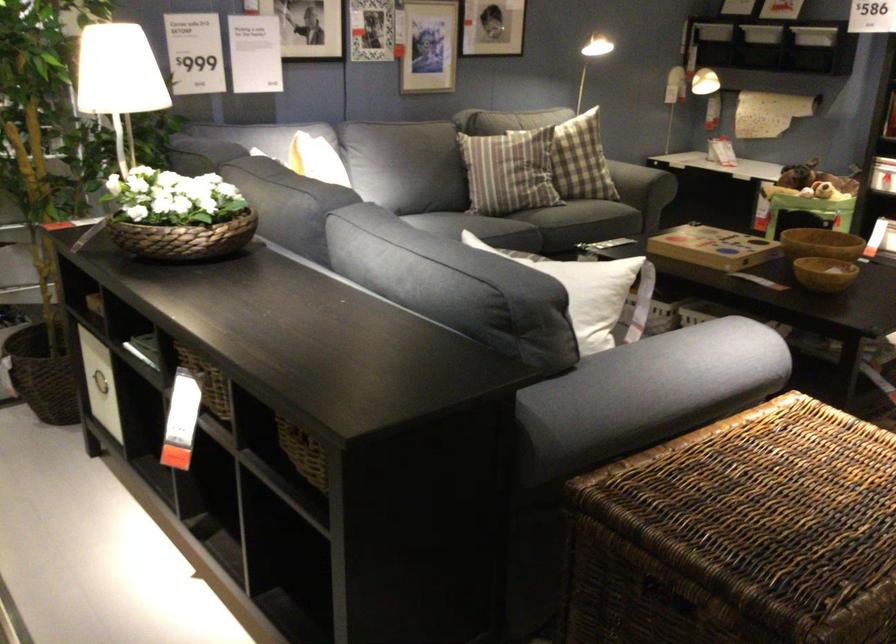
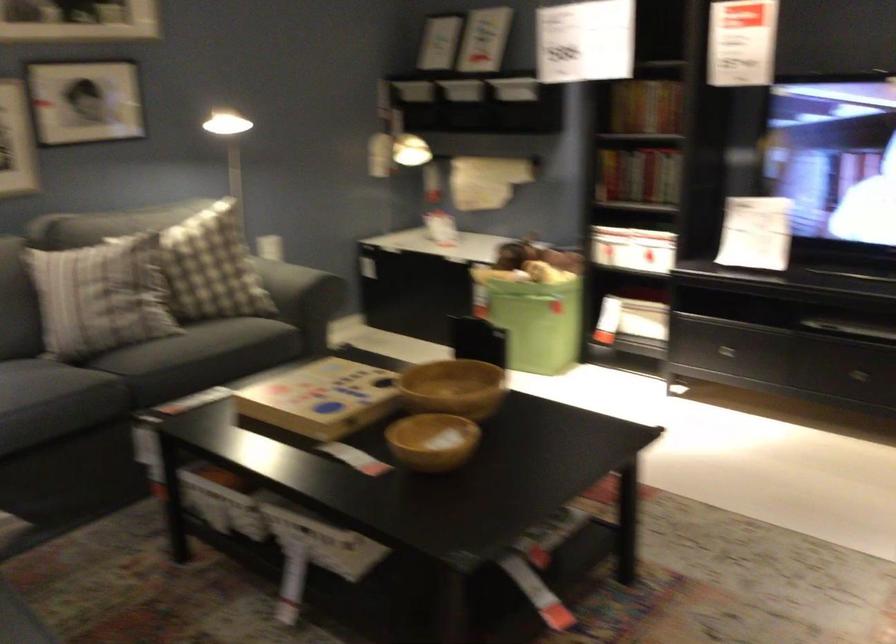
Consider the image. In a continuous first-person perspective shot, in which direction is the camera moving?

The cameraman walked toward right, forward.